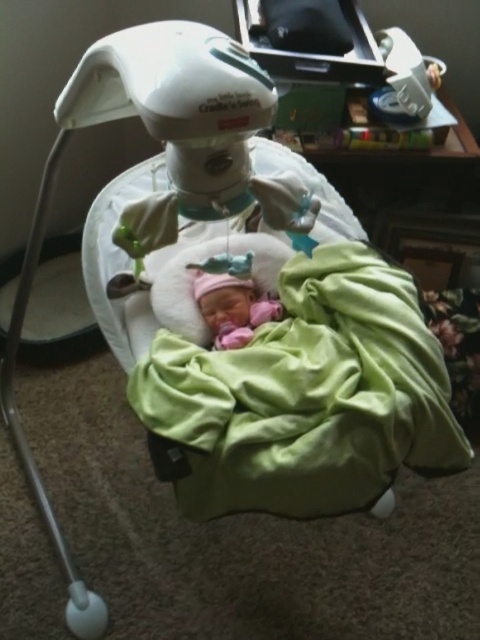
Between green soft blanket at center and pink fabric newborn at center, which one appears on the left side from the viewer's perspective?

pink fabric newborn at center is more to the left.

Does green soft blanket at center have a lesser width compared to pink fabric newborn at center?

No.

This screenshot has height=640, width=480. Find the location of `green soft blanket at center`. green soft blanket at center is located at coordinates (304, 397).

Locate an element on the screen. green soft blanket at center is located at coordinates (304, 397).